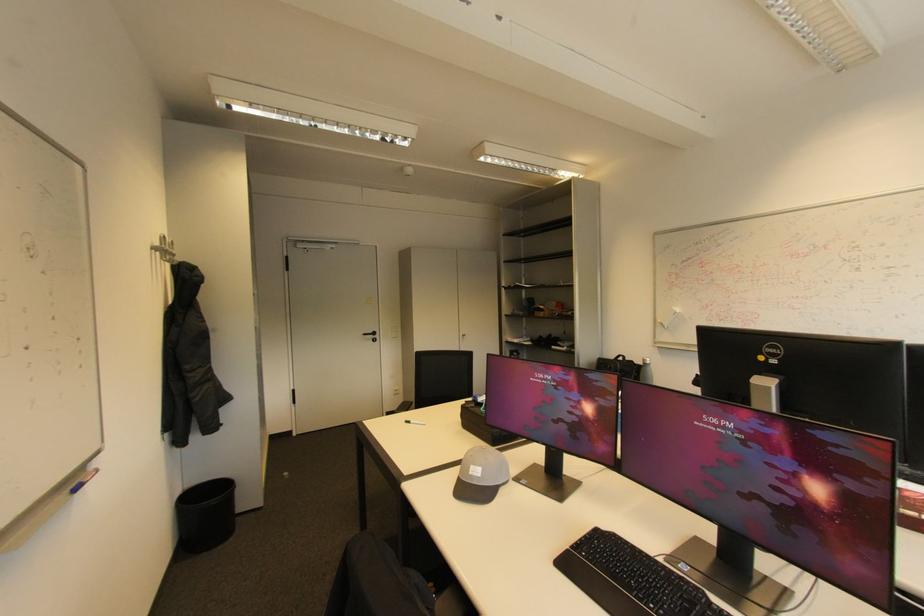
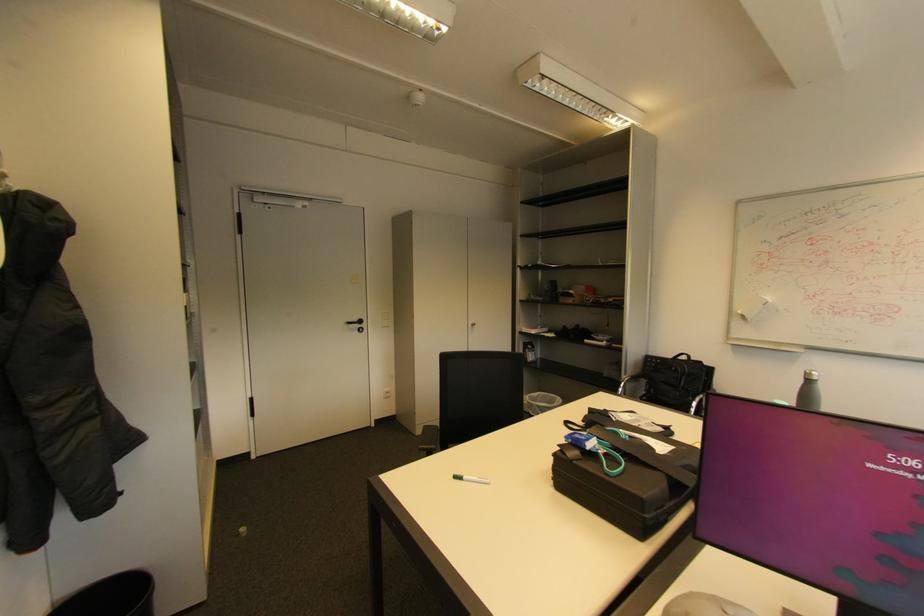
Where in the second image is the point corresponding to pixel 469 336 from the first image?

(479, 326)